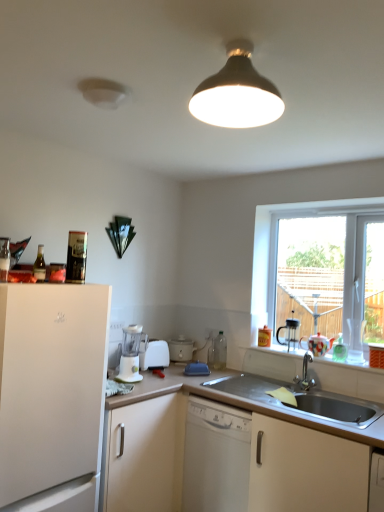
Question: In which direction should I rotate to look at matte white slow cooker at center, the first appliance viewed from the back?

Choices:
 (A) right
 (B) left

Answer: (B)

Question: Which direction should I rotate to look at white plastic coffee machine at lower center, the first coffee machine viewed from the left?

Choices:
 (A) right
 (B) left

Answer: (B)

Question: Is white plastic toaster at center, positioned as the first appliance in left-to-right order, located outside black plastic coffee machine at right, placed as the 2th coffee machine when sorted from front to back?

Choices:
 (A) yes
 (B) no

Answer: (A)

Question: Is white plastic toaster at center, which ranks as the 2th appliance in right-to-left order, taller than black plastic coffee machine at right, which appears as the first coffee machine when viewed from the back?

Choices:
 (A) no
 (B) yes

Answer: (A)

Question: Can you confirm if white plastic toaster at center, which ranks as the 2th appliance in right-to-left order, is wider than black plastic coffee machine at right, placed as the 2th coffee machine when sorted from front to back?

Choices:
 (A) no
 (B) yes

Answer: (B)

Question: From the image's perspective, is white plastic toaster at center, the first appliance positioned from the front, below black plastic coffee machine at right, the 2th coffee machine positioned from the left?

Choices:
 (A) no
 (B) yes

Answer: (B)

Question: Considering the relative positions of white plastic toaster at center, which is counted as the 2th appliance, starting from the back, and black plastic coffee machine at right, placed as the 2th coffee machine when sorted from front to back, in the image provided, is white plastic toaster at center, which is counted as the 2th appliance, starting from the back, in front of black plastic coffee machine at right, placed as the 2th coffee machine when sorted from front to back,?

Choices:
 (A) no
 (B) yes

Answer: (A)

Question: Considering the relative sizes of white plastic toaster at center, which is counted as the 2th appliance, starting from the back, and black plastic coffee machine at right, which appears as the first coffee machine when viewed from the back, in the image provided, is white plastic toaster at center, which is counted as the 2th appliance, starting from the back, thinner than black plastic coffee machine at right, which appears as the first coffee machine when viewed from the back,?

Choices:
 (A) yes
 (B) no

Answer: (B)

Question: Is matte black lampshade at upper center at the left side of white plastic toaster at center, positioned as the first appliance in left-to-right order?

Choices:
 (A) yes
 (B) no

Answer: (B)

Question: Does matte black lampshade at upper center have a lesser height compared to white plastic toaster at center, which is counted as the 2th appliance, starting from the back?

Choices:
 (A) yes
 (B) no

Answer: (B)

Question: Can you confirm if matte black lampshade at upper center is bigger than white plastic toaster at center, positioned as the first appliance in left-to-right order?

Choices:
 (A) yes
 (B) no

Answer: (A)

Question: From the image's perspective, is matte black lampshade at upper center on white plastic toaster at center, positioned as the first appliance in left-to-right order?

Choices:
 (A) no
 (B) yes

Answer: (B)

Question: From a real-world perspective, is matte black lampshade at upper center positioned under white plastic toaster at center, the first appliance positioned from the front, based on gravity?

Choices:
 (A) no
 (B) yes

Answer: (A)

Question: Can you confirm if matte black lampshade at upper center is wider than white plastic toaster at center, positioned as the first appliance in left-to-right order?

Choices:
 (A) yes
 (B) no

Answer: (A)

Question: Is white plastic coffee machine at lower center, which is counted as the second coffee machine, starting from the right, bigger than black plastic coffee machine at right, placed as the 2th coffee machine when sorted from front to back?

Choices:
 (A) yes
 (B) no

Answer: (A)